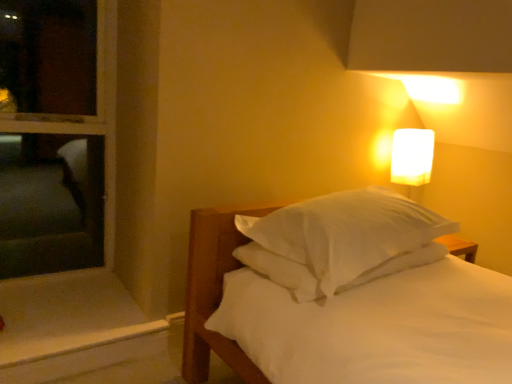
Question: From a real-world perspective, is white soft bed at center located higher than white frosted glass at upper right?

Choices:
 (A) yes
 (B) no

Answer: (B)

Question: Is white soft bed at center positioned in front of white frosted glass at upper right?

Choices:
 (A) yes
 (B) no

Answer: (A)

Question: Is white soft bed at center taller than white frosted glass at upper right?

Choices:
 (A) yes
 (B) no

Answer: (A)

Question: Is white frosted glass at upper right inside white soft bed at center?

Choices:
 (A) no
 (B) yes

Answer: (A)

Question: Is white soft bed at center to the left of white frosted glass at upper right from the viewer's perspective?

Choices:
 (A) yes
 (B) no

Answer: (A)

Question: Is white frosted glass at upper right at the back of white soft bed at center?

Choices:
 (A) yes
 (B) no

Answer: (B)

Question: Is white soft bed at center completely or partially inside white wood window sill at lower left?

Choices:
 (A) yes
 (B) no

Answer: (B)

Question: Would you say white wood window sill at lower left is outside white soft bed at center?

Choices:
 (A) yes
 (B) no

Answer: (A)

Question: From a real-world perspective, is white wood window sill at lower left located beneath white soft bed at center?

Choices:
 (A) no
 (B) yes

Answer: (B)

Question: Could you tell me if white wood window sill at lower left is facing white soft bed at center?

Choices:
 (A) no
 (B) yes

Answer: (A)

Question: Does white wood window sill at lower left have a greater height compared to white soft bed at center?

Choices:
 (A) yes
 (B) no

Answer: (B)

Question: Is white wood window sill at lower left at the left side of white soft bed at center?

Choices:
 (A) no
 (B) yes

Answer: (B)

Question: Can you confirm if white frosted glass at upper right is positioned to the right of white soft bed at center?

Choices:
 (A) yes
 (B) no

Answer: (A)